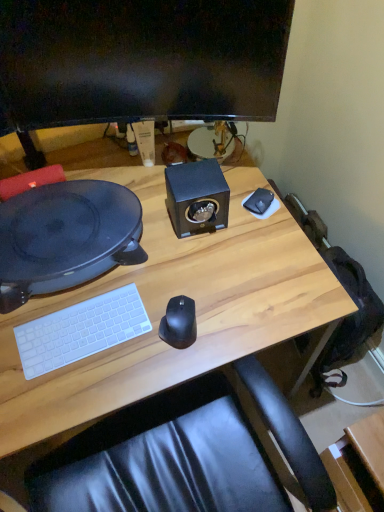
Where is `vacant space that's between black matte speaker at center and black plastic record player at left`? Image resolution: width=384 pixels, height=512 pixels. vacant space that's between black matte speaker at center and black plastic record player at left is located at coordinates (163, 217).